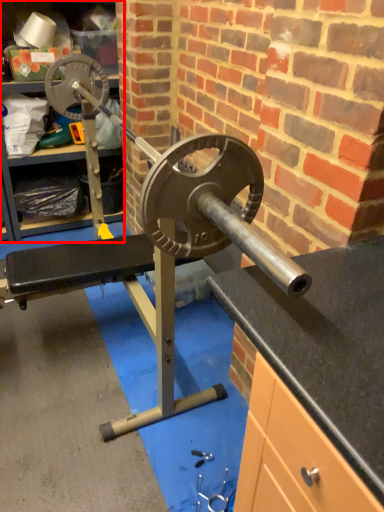
Question: Observing the image, what is the correct spatial positioning of cabinet (annotated by the red box) in reference to tool?

Choices:
 (A) left
 (B) right

Answer: (A)